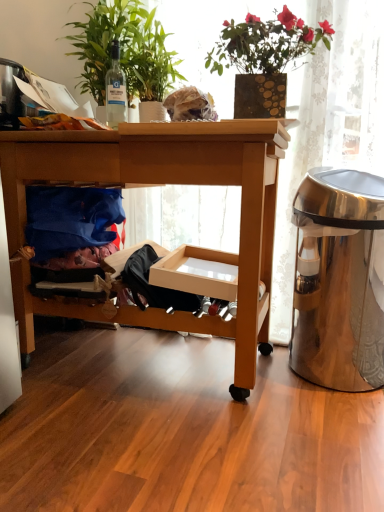
Question: Does green glossy plant at upper left, which ranks as the 2th houseplant in right-to-left order, have a smaller size compared to satin silver trash can at right?

Choices:
 (A) yes
 (B) no

Answer: (A)

Question: Is green glossy plant at upper left, which ranks as the 2th houseplant in right-to-left order, at the right side of satin silver trash can at right?

Choices:
 (A) no
 (B) yes

Answer: (A)

Question: Can you confirm if green glossy plant at upper left, the first houseplant from the left, is bigger than satin silver trash can at right?

Choices:
 (A) no
 (B) yes

Answer: (A)

Question: From a real-world perspective, is green glossy plant at upper left, the first houseplant from the left, located higher than satin silver trash can at right?

Choices:
 (A) yes
 (B) no

Answer: (A)

Question: Is satin silver trash can at right located within green glossy plant at upper left, the first houseplant from the left?

Choices:
 (A) no
 (B) yes

Answer: (A)

Question: Does green glossy plant at upper left, the first houseplant from the left, appear on the left side of satin silver trash can at right?

Choices:
 (A) yes
 (B) no

Answer: (A)

Question: Can you confirm if green glossy plant at upper left, the first houseplant from the left, is wider than blue fabric at lower left?

Choices:
 (A) yes
 (B) no

Answer: (A)

Question: Is green glossy plant at upper left, which ranks as the 2th houseplant in right-to-left order, outside blue fabric at lower left?

Choices:
 (A) yes
 (B) no

Answer: (A)

Question: Can you confirm if green glossy plant at upper left, which ranks as the 2th houseplant in right-to-left order, is smaller than blue fabric at lower left?

Choices:
 (A) yes
 (B) no

Answer: (B)

Question: From a real-world perspective, is green glossy plant at upper left, which ranks as the 2th houseplant in right-to-left order, on top of blue fabric at lower left?

Choices:
 (A) yes
 (B) no

Answer: (A)

Question: From the image's perspective, is green glossy plant at upper left, which ranks as the 2th houseplant in right-to-left order, over blue fabric at lower left?

Choices:
 (A) no
 (B) yes

Answer: (B)

Question: Is blue fabric at lower left located within green glossy plant at upper left, the first houseplant from the left?

Choices:
 (A) yes
 (B) no

Answer: (B)

Question: Considering the relative sizes of clear glass bottle at upper left and blue fabric at lower left in the image provided, is clear glass bottle at upper left wider than blue fabric at lower left?

Choices:
 (A) yes
 (B) no

Answer: (B)